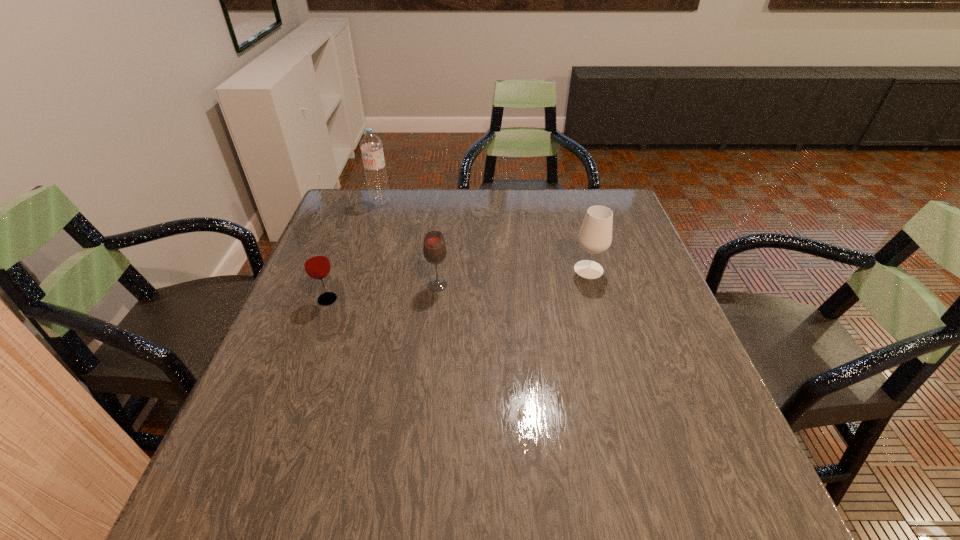
Where is `vacant area that lies between the leftmost glass and the water bottle`? The width and height of the screenshot is (960, 540). vacant area that lies between the leftmost glass and the water bottle is located at coordinates (354, 251).

Where is `vacant region between the rightmost object and the leftmost glass`? vacant region between the rightmost object and the leftmost glass is located at coordinates [x=458, y=285].

Image resolution: width=960 pixels, height=540 pixels. I want to click on free spot between the leftmost glass and the rightmost glass, so click(458, 285).

Identify the location of vacant space that is in between the leftmost glass and the rightmost glass. (458, 285).

Locate an element on the screen. The height and width of the screenshot is (540, 960). free point between the tallest object and the rightmost object is located at coordinates (485, 235).

Image resolution: width=960 pixels, height=540 pixels. I want to click on vacant space that's between the rightmost object and the second glass from right to left, so click(513, 278).

At what (x,y) coordinates should I click in order to perform the action: click on free space between the second object from right to left and the rightmost glass. Please return your answer as a coordinate pair (x, y). Image resolution: width=960 pixels, height=540 pixels. Looking at the image, I should click on (513, 278).

You are a GUI agent. You are given a task and a screenshot of the screen. Output one action in this format:
    pyautogui.click(x=<x>, y=<y>)
    Task: Click on the free spot between the rightmost glass and the leftmost glass
    The height and width of the screenshot is (540, 960).
    Given the screenshot: What is the action you would take?
    point(458,285)

Identify the location of free point between the leftmost glass and the water bottle. (354, 251).

Locate an element on the screen. This screenshot has height=540, width=960. the third closest object to the third object from left to right is located at coordinates (371, 146).